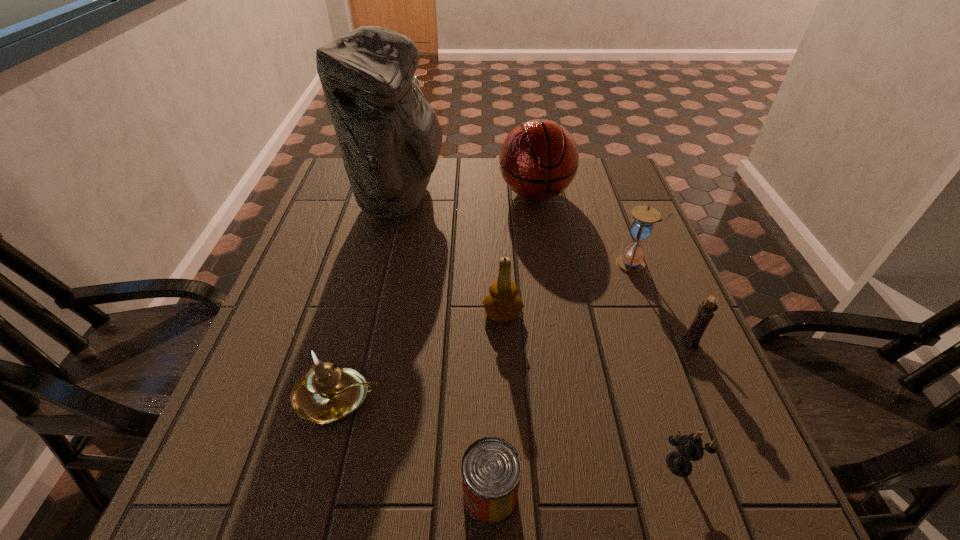
The height and width of the screenshot is (540, 960). What are the coordinates of `backpack that is at the far edge` in the screenshot? It's located at (389, 135).

This screenshot has width=960, height=540. I want to click on basketball at the far edge, so click(x=539, y=159).

Where is `candle holder that is at the near edge`? This screenshot has width=960, height=540. candle holder that is at the near edge is located at coordinates (689, 448).

Where is `can located in the near edge section of the desktop`? This screenshot has width=960, height=540. can located in the near edge section of the desktop is located at coordinates (491, 468).

This screenshot has width=960, height=540. I want to click on backpack that is at the left edge, so point(389,135).

Identify the location of candle holder at the left edge. The width and height of the screenshot is (960, 540). (327, 393).

Find the location of a particular element. hourglass positioned at the right edge is located at coordinates (631, 262).

Where is `object that is positioned at the far left corner`? object that is positioned at the far left corner is located at coordinates (389, 135).

Image resolution: width=960 pixels, height=540 pixels. What are the coordinates of `object present at the near right corner` in the screenshot? It's located at (689, 448).

Find the location of a particular element. The width and height of the screenshot is (960, 540). vacant space at the far edge of the desktop is located at coordinates (444, 160).